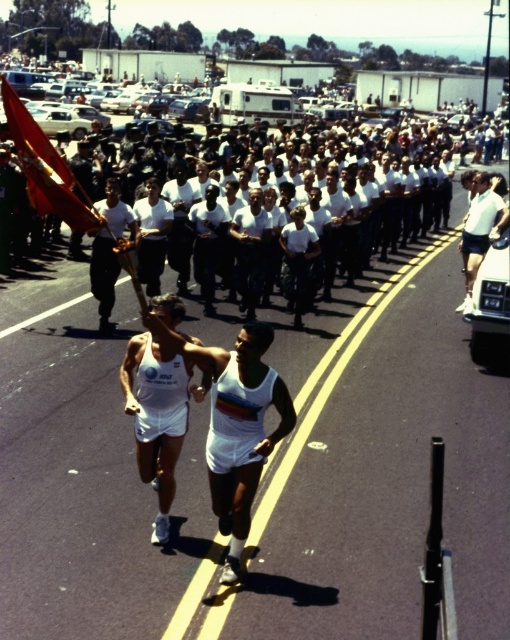
You are a photographer at the marathon event and want to capture a photo that includes both the white matte singlet at center and the white fabric tank top at center. Which one should you focus on first to ensure both are in frame?

The white matte singlet at center is below the white fabric tank top at center, so you should focus on the white fabric tank top at center first to ensure both are in frame.

You are a photographer at the marathon event and want to capture both the white matte singlet at center and the red fabric flag at upper left in the same frame. Based on their positions, which object should you focus on first to ensure both are in the shot?

The white matte singlet at center is positioned on the right side of the red fabric flag at upper left, so you should focus on the red fabric flag at upper left first to ensure both are in the shot.

You are a photographer positioned at the back of the runners. You need to capture a clear photo of both the white matte singlet at center and the white fabric tank top at center. Which clothing item will appear taller in the photo?

The white matte singlet at center will appear taller in the photo because it has a greater height compared to the white fabric tank top at center.